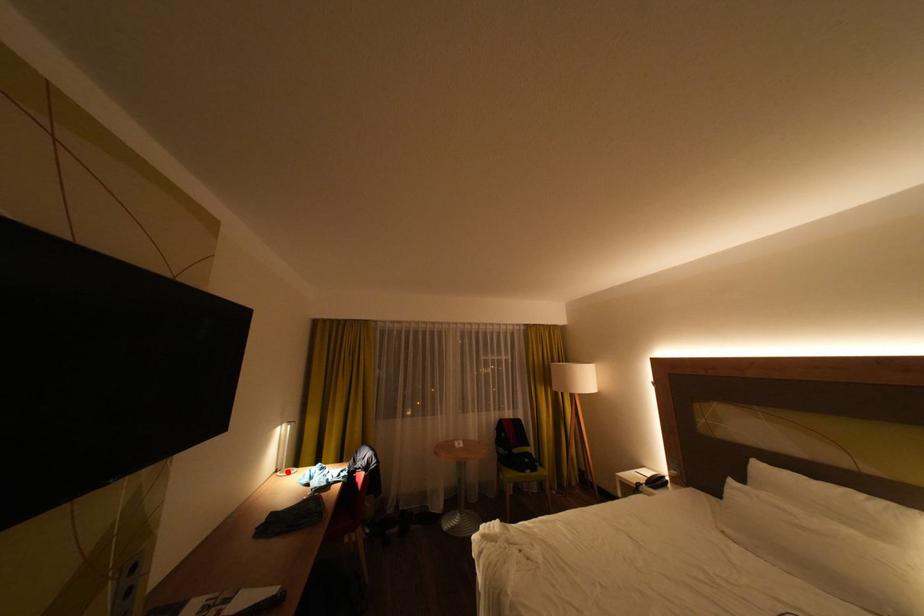
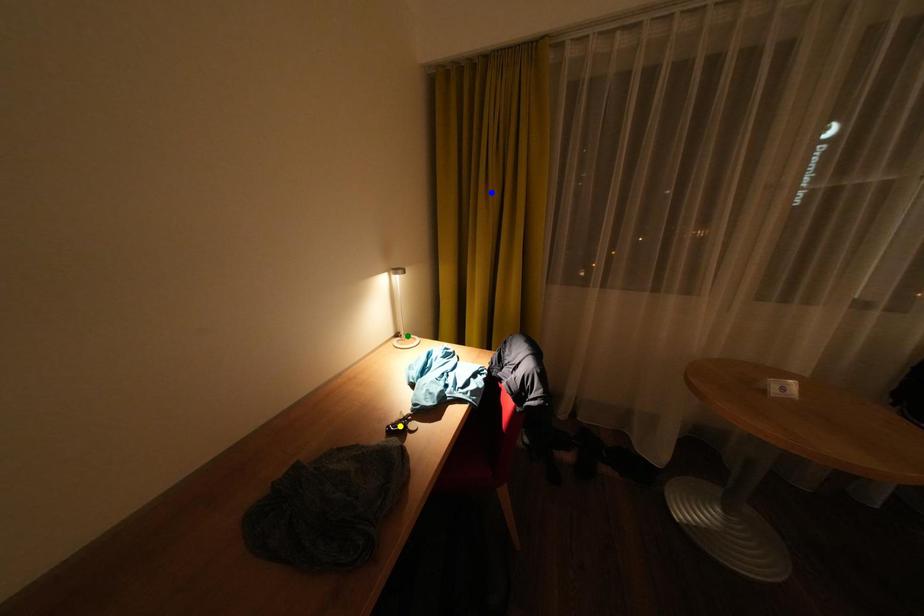
Question: I am providing you with two images of the same scene from different viewpoints. A red point is marked on the first image. You are given multiple points on the second image. Which spot in image 2 lines up with the point in image 1?

Choices:
 (A) blue point
 (B) yellow point
 (C) green point

Answer: (C)